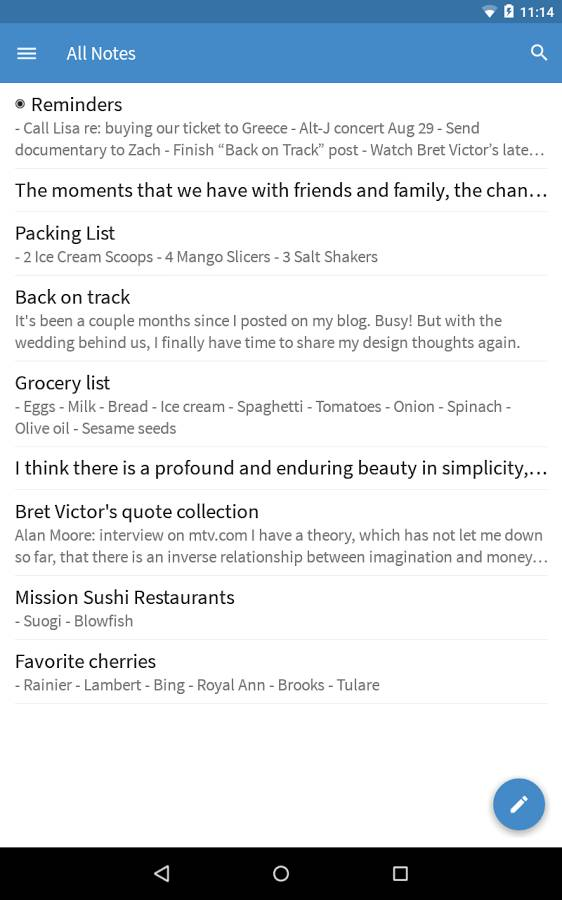
At what (x,y) coordinates should I click in order to perform the action: click on notes. Please return your answer as a coordinate pair (x, y). Looking at the image, I should click on (105, 40).